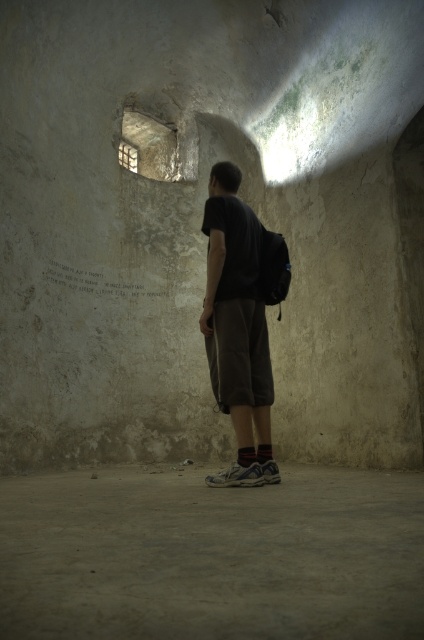
Question: Is smooth concrete floor at lower center closer to the viewer compared to white paper at center?

Choices:
 (A) no
 (B) yes

Answer: (B)

Question: Does dark gray cotton t-shirt at center have a smaller size compared to white paper at center?

Choices:
 (A) yes
 (B) no

Answer: (B)

Question: Which object is positioned farthest from the dark gray cotton t-shirt at center?

Choices:
 (A) smooth concrete floor at lower center
 (B) white paper at center

Answer: (B)

Question: Does smooth concrete floor at lower center appear over white paper at center?

Choices:
 (A) no
 (B) yes

Answer: (A)

Question: Which is nearer to the white paper at center?

Choices:
 (A) smooth concrete floor at lower center
 (B) dark gray cotton t-shirt at center

Answer: (B)

Question: Based on their relative distances, which object is nearer to the smooth concrete floor at lower center?

Choices:
 (A) white paper at center
 (B) dark gray cotton t-shirt at center

Answer: (B)